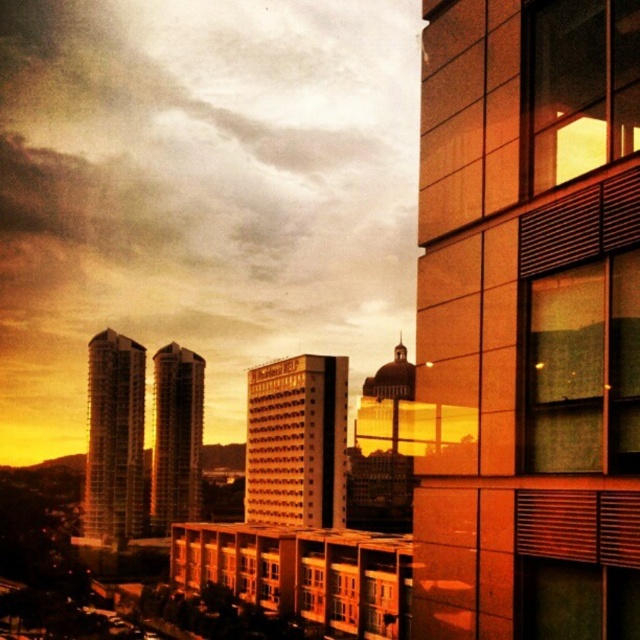
Question: Does transparent glass window at right have a larger size compared to matte glass window at upper right?

Choices:
 (A) no
 (B) yes

Answer: (B)

Question: Which object is closer to the camera taking this photo?

Choices:
 (A) transparent glass window at right
 (B) matte glass window at upper right

Answer: (A)

Question: Does transparent glass window at right appear on the left side of matte glass window at upper right?

Choices:
 (A) yes
 (B) no

Answer: (A)

Question: Which point is closer to the camera?

Choices:
 (A) (525, 74)
 (B) (572, 358)

Answer: (B)

Question: Considering the relative positions of transparent glass window at right and matte glass window at upper right in the image provided, where is transparent glass window at right located with respect to matte glass window at upper right?

Choices:
 (A) left
 (B) right

Answer: (A)